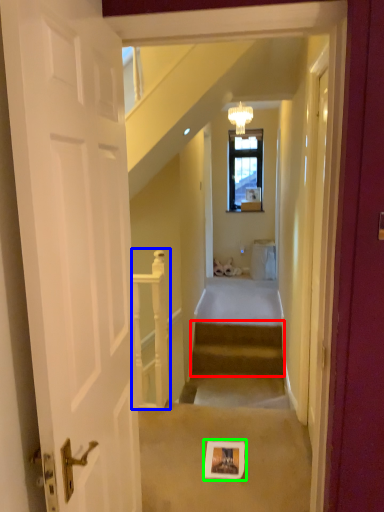
Question: Considering the real-world distances, which object is farthest from stairs (highlighted by a red box)? rail (highlighted by a blue box) or picture frame (highlighted by a green box)?

Choices:
 (A) rail
 (B) picture frame

Answer: (B)